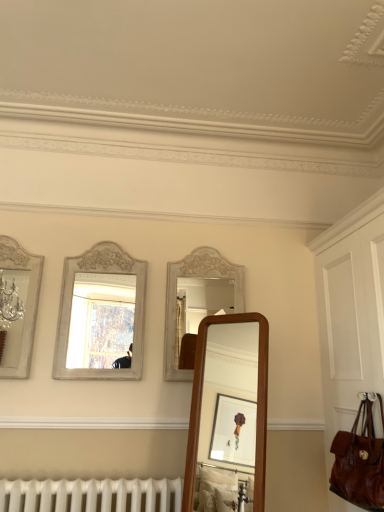
Question: Is brown leather handbag at lower right completely or partially inside silver metallic mirror at left, arranged as the 1th mirror when viewed from the left?

Choices:
 (A) yes
 (B) no

Answer: (B)

Question: Are silver metallic mirror at left, arranged as the 1th mirror when viewed from the left, and brown leather handbag at lower right located far from each other?

Choices:
 (A) no
 (B) yes

Answer: (B)

Question: From a real-world perspective, is silver metallic mirror at left, placed as the 2th mirror when sorted from right to left, physically above brown leather handbag at lower right?

Choices:
 (A) no
 (B) yes

Answer: (B)

Question: Is silver metallic mirror at left, placed as the 2th mirror when sorted from right to left, turned away from brown leather handbag at lower right?

Choices:
 (A) yes
 (B) no

Answer: (B)

Question: Considering the relative sizes of silver metallic mirror at left, arranged as the 1th mirror when viewed from the left, and brown leather handbag at lower right in the image provided, is silver metallic mirror at left, arranged as the 1th mirror when viewed from the left, wider than brown leather handbag at lower right?

Choices:
 (A) yes
 (B) no

Answer: (B)

Question: Is silver metallic mirror at left, placed as the 2th mirror when sorted from right to left, inside the boundaries of brown leather bag at right, or outside?

Choices:
 (A) inside
 (B) outside

Answer: (B)

Question: From a real-world perspective, relative to brown leather bag at right, is silver metallic mirror at left, arranged as the 1th mirror when viewed from the left, vertically above or below?

Choices:
 (A) above
 (B) below

Answer: (A)

Question: Is silver metallic mirror at left, arranged as the 1th mirror when viewed from the left, taller or shorter than brown leather bag at right?

Choices:
 (A) tall
 (B) short

Answer: (B)

Question: Looking at their shapes, would you say silver metallic mirror at left, placed as the 2th mirror when sorted from right to left, is wider or thinner than brown leather bag at right?

Choices:
 (A) thin
 (B) wide

Answer: (A)

Question: From a real-world perspective, is brown leather bag at right physically located above or below silver metallic mirror at left, arranged as the 1th mirror when viewed from the left?

Choices:
 (A) above
 (B) below

Answer: (B)

Question: Considering the positions of point (339, 387) and point (24, 346), is point (339, 387) closer or farther from the camera than point (24, 346)?

Choices:
 (A) farther
 (B) closer

Answer: (A)

Question: From their relative heights in the image, would you say brown leather bag at right is taller or shorter than silver metallic mirror at left, arranged as the 1th mirror when viewed from the left?

Choices:
 (A) tall
 (B) short

Answer: (A)

Question: In terms of width, does brown leather bag at right look wider or thinner when compared to silver metallic mirror at left, arranged as the 1th mirror when viewed from the left?

Choices:
 (A) thin
 (B) wide

Answer: (B)

Question: Considering the relative positions of white painted wood mirror at center, the 2th mirror viewed from the left, and brown leather bag at right in the image provided, is white painted wood mirror at center, the 2th mirror viewed from the left, to the left or to the right of brown leather bag at right?

Choices:
 (A) left
 (B) right

Answer: (A)

Question: From a real-world perspective, relative to brown leather bag at right, is white painted wood mirror at center, marked as the first mirror in a right-to-left arrangement, vertically above or below?

Choices:
 (A) above
 (B) below

Answer: (A)